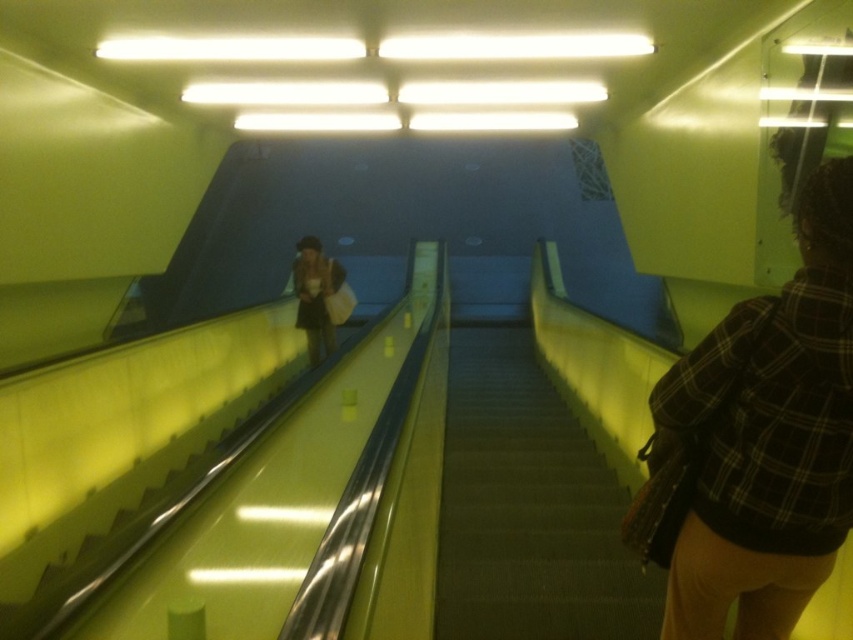
Does plaid fabric shirt at right have a greater width compared to dark gray carpeted stairs at center?

No.

Who is more distant from viewer, (727, 536) or (483, 506)?

Positioned behind is point (483, 506).

Between point (694, 532) and point (585, 566), which one is positioned in front?

Point (694, 532) is more forward.

The image size is (853, 640). In order to click on plaid fabric shirt at right in this screenshot , I will do `click(767, 436)`.

Can you confirm if dark gray carpeted stairs at center is bigger than matte beige bag at center?

Actually, dark gray carpeted stairs at center might be smaller than matte beige bag at center.

Is dark gray carpeted stairs at center thinner than matte beige bag at center?

Yes, dark gray carpeted stairs at center is thinner than matte beige bag at center.

The image size is (853, 640). What do you see at coordinates (529, 508) in the screenshot? I see `dark gray carpeted stairs at center` at bounding box center [529, 508].

What are the coordinates of `dark gray carpeted stairs at center` in the screenshot? It's located at (529, 508).

Between plaid fabric shirt at right and matte beige bag at center, which one is positioned higher?

matte beige bag at center is higher up.

Between plaid fabric shirt at right and matte beige bag at center, which one has less height?

Standing shorter between the two is plaid fabric shirt at right.

The image size is (853, 640). Identify the location of plaid fabric shirt at right. (767, 436).

Locate an element on the screen. plaid fabric shirt at right is located at coordinates 767,436.